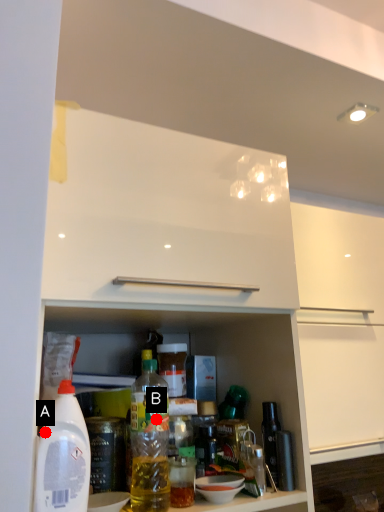
Question: Two points are circled on the image, labeled by A and B beside each circle. Which point is farther to the camera?

Choices:
 (A) A is further
 (B) B is further

Answer: (B)